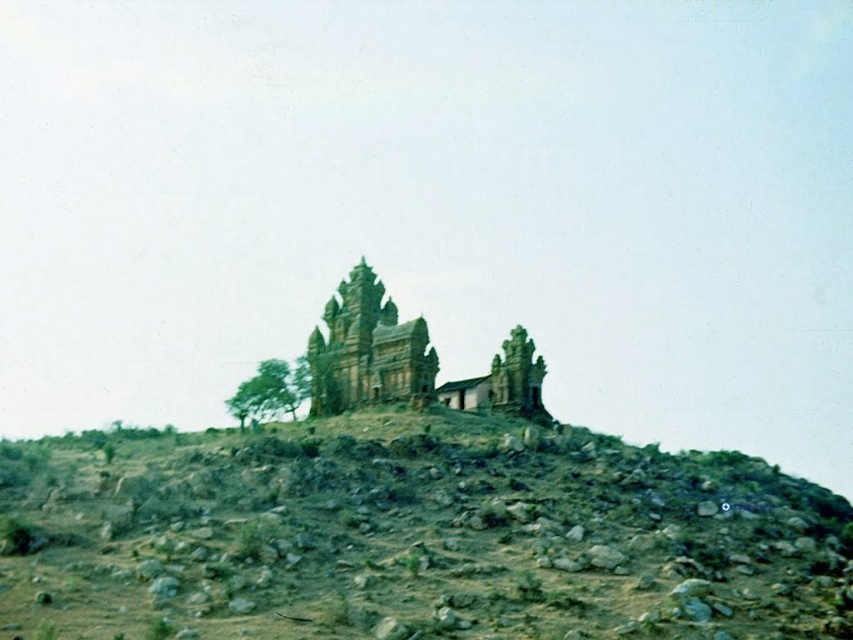
Question: Which point is closer to the camera taking this photo?

Choices:
 (A) (720, 512)
 (B) (264, 378)
 (C) (352, 380)

Answer: (A)

Question: Is brown rocky hillside at center further to camera compared to green leafy tree at center?

Choices:
 (A) no
 (B) yes

Answer: (A)

Question: Is brown stone ruins at center positioned behind green leafy tree at center?

Choices:
 (A) no
 (B) yes

Answer: (A)

Question: Is brown stone ruins at center to the left of green leafy tree at center from the viewer's perspective?

Choices:
 (A) yes
 (B) no

Answer: (B)

Question: Based on their relative distances, which object is nearer to the brown stone ruins at center?

Choices:
 (A) brown rocky hillside at center
 (B) green leafy tree at center

Answer: (B)

Question: Which of the following is the farthest from the observer?

Choices:
 (A) (259, 369)
 (B) (341, 385)
 (C) (577, 468)

Answer: (B)